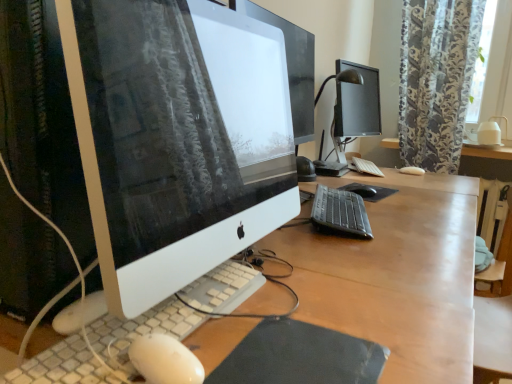
Question: Does black glossy monitor at upper right have a greater width compared to black matte mousepad at lower center, arranged as the first mousepad when ordered from the bottom?

Choices:
 (A) yes
 (B) no

Answer: (B)

Question: From a real-world perspective, is black glossy monitor at upper right on top of black matte mousepad at lower center, arranged as the first mousepad when ordered from the bottom?

Choices:
 (A) yes
 (B) no

Answer: (A)

Question: Is black glossy monitor at upper right at the right side of black matte mousepad at lower center, positioned as the second mousepad in right-to-left order?

Choices:
 (A) no
 (B) yes

Answer: (B)

Question: Is black glossy monitor at upper right taller than black matte mousepad at lower center, marked as the second mousepad in a back-to-front arrangement?

Choices:
 (A) no
 (B) yes

Answer: (B)

Question: Is black glossy monitor at upper right not inside black matte mousepad at lower center, positioned as the second mousepad in right-to-left order?

Choices:
 (A) no
 (B) yes

Answer: (B)

Question: In terms of height, does white matte keyboard at center, the third computer keyboard when ordered from front to back, look taller or shorter compared to wooden desk at center, placed as the first desk when sorted from bottom to top?

Choices:
 (A) short
 (B) tall

Answer: (A)

Question: Based on their sizes in the image, would you say white matte keyboard at center, the third computer keyboard from the left, is bigger or smaller than wooden desk at center, placed as the 1th desk when sorted from left to right?

Choices:
 (A) big
 (B) small

Answer: (B)

Question: Is white matte keyboard at center, placed as the third computer keyboard when sorted from bottom to top, situated inside wooden desk at center, placed as the 1th desk when sorted from left to right, or outside?

Choices:
 (A) outside
 (B) inside

Answer: (B)

Question: Visually, is white matte keyboard at center, placed as the third computer keyboard when sorted from bottom to top, positioned to the left or to the right of wooden desk at center, positioned as the second desk in back-to-front order?

Choices:
 (A) right
 (B) left

Answer: (A)

Question: In terms of width, does white textured keyboard at center, which appears as the 3th computer keyboard when viewed from the back, look wider or thinner when compared to black glossy monitor at upper right?

Choices:
 (A) thin
 (B) wide

Answer: (A)

Question: From a real-world perspective, is white textured keyboard at center, acting as the first computer keyboard starting from the front, positioned above or below black glossy monitor at upper right?

Choices:
 (A) below
 (B) above

Answer: (A)

Question: Is white textured keyboard at center, the first computer keyboard from the left, inside the boundaries of black glossy monitor at upper right, or outside?

Choices:
 (A) inside
 (B) outside

Answer: (B)

Question: Considering the positions of white textured keyboard at center, the 3th computer keyboard from the right, and black glossy monitor at upper right in the image, is white textured keyboard at center, the 3th computer keyboard from the right, bigger or smaller than black glossy monitor at upper right?

Choices:
 (A) small
 (B) big

Answer: (A)

Question: In terms of width, does floral-patterned fabric at upper right look wider or thinner when compared to white glossy computer monitor at center?

Choices:
 (A) thin
 (B) wide

Answer: (B)

Question: Considering the positions of floral-patterned fabric at upper right and white glossy computer monitor at center in the image, is floral-patterned fabric at upper right bigger or smaller than white glossy computer monitor at center?

Choices:
 (A) small
 (B) big

Answer: (B)